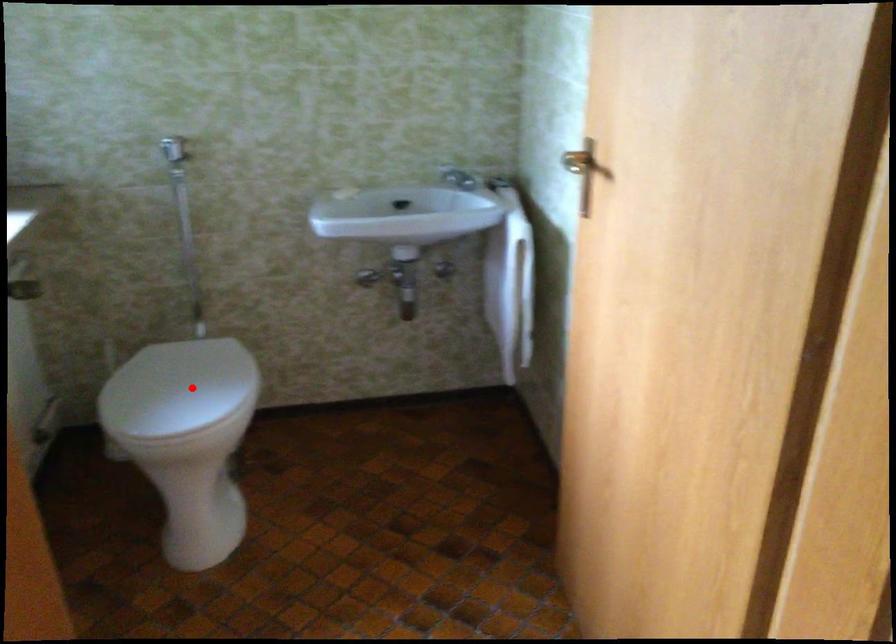
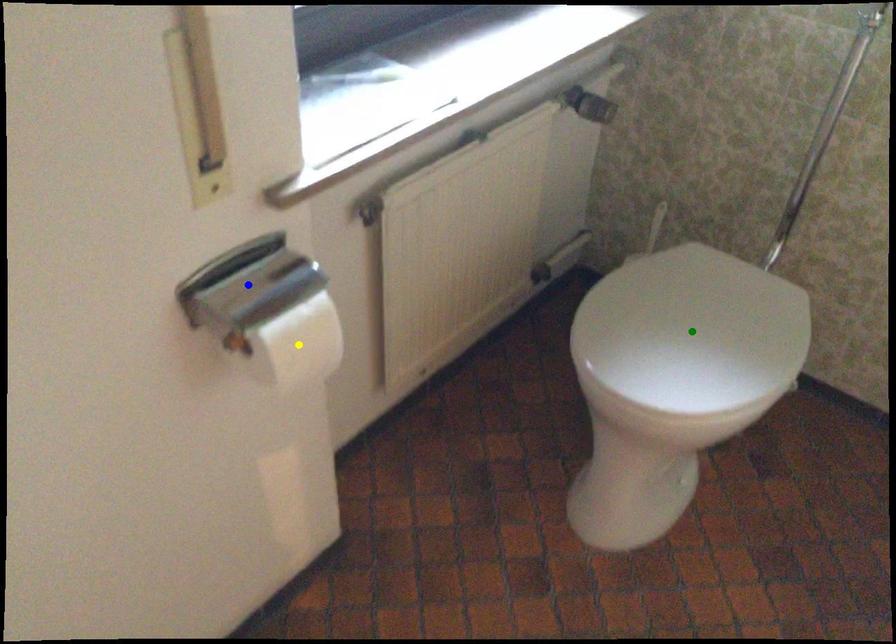
Question: I am providing you with two images of the same scene from different viewpoints. A red point is marked on the first image. You are given multiple points on the second image. Which point in image 2 represents the same 3d spot as the red point in image 1?

Choices:
 (A) yellow point
 (B) green point
 (C) blue point

Answer: (B)